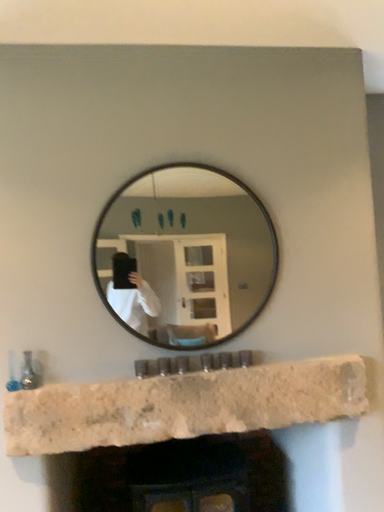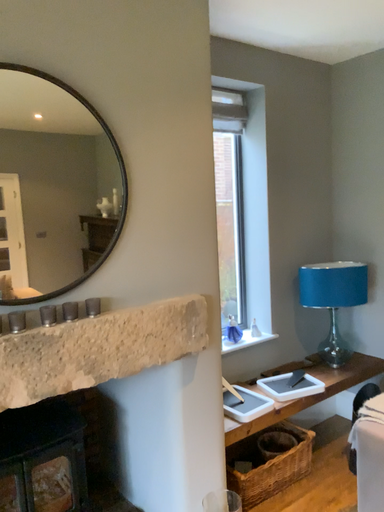
Question: Which way did the camera rotate in the video?

Choices:
 (A) rotated upward
 (B) rotated downward

Answer: (B)